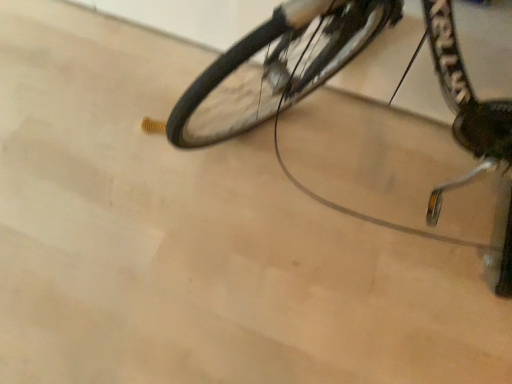
Identify the location of black rubber bicycle at center. This screenshot has height=384, width=512. (279, 65).

Describe the element at coordinates (279, 65) in the screenshot. The image size is (512, 384). I see `black rubber bicycle at center` at that location.

Describe the element at coordinates (276, 67) in the screenshot. I see `black rubber tire at center` at that location.

Find the location of a particular element. This screenshot has height=384, width=512. black rubber tire at center is located at coordinates (276, 67).

Image resolution: width=512 pixels, height=384 pixels. I want to click on black rubber bicycle at center, so click(279, 65).

Can you confirm if black rubber tire at center is positioned to the right of black rubber bicycle at center?

No.

Which object is closer to the camera taking this photo, black rubber tire at center or black rubber bicycle at center?

black rubber bicycle at center is more forward.

Which is in front, point (174, 118) or point (213, 75)?

The point (213, 75) is in front.

From the image's perspective, is black rubber tire at center below black rubber bicycle at center?

Actually, black rubber tire at center appears above black rubber bicycle at center in the image.

From a real-world perspective, which is physically above, black rubber tire at center or black rubber bicycle at center?

From a 3D spatial view, black rubber bicycle at center is above.

Which object is wider, black rubber tire at center or black rubber bicycle at center?

With larger width is black rubber bicycle at center.

Is black rubber tire at center shorter than black rubber bicycle at center?

Correct, black rubber tire at center is not as tall as black rubber bicycle at center.

Considering the relative sizes of black rubber tire at center and black rubber bicycle at center in the image provided, is black rubber tire at center smaller than black rubber bicycle at center?

Yes.

Is black rubber bicycle at center located within black rubber tire at center?

Definitely not — black rubber bicycle at center is not inside black rubber tire at center.

Is black rubber tire at center next to black rubber bicycle at center and touching it?

Yes, black rubber tire at center is touching black rubber bicycle at center.

Is black rubber tire at center aimed at black rubber bicycle at center?

Yes, black rubber tire at center is oriented towards black rubber bicycle at center.

How far apart are black rubber tire at center and black rubber bicycle at center?

A distance of 5.44 centimeters exists between black rubber tire at center and black rubber bicycle at center.

Where is `bicycle wheel lying on the left of black rubber bicycle at center`? bicycle wheel lying on the left of black rubber bicycle at center is located at coordinates (276, 67).

Looking at this image, is black rubber bicycle at center to the left of black rubber tire at center from the viewer's perspective?

No.

Relative to black rubber tire at center, is black rubber bicycle at center in front or behind?

Visually, black rubber bicycle at center is located in front of black rubber tire at center.

Which is behind, point (508, 165) or point (216, 133)?

The point (216, 133) is farther from the camera.

From the image's perspective, which is above, black rubber bicycle at center or black rubber tire at center?

From the image's view, black rubber tire at center is above.

From a real-world perspective, which is physically above, black rubber bicycle at center or black rubber tire at center?

In real-world perspective, black rubber bicycle at center is above.

Looking at this image, can you confirm if black rubber bicycle at center is wider than black rubber tire at center?

Indeed, black rubber bicycle at center has a greater width compared to black rubber tire at center.

Who is shorter, black rubber bicycle at center or black rubber tire at center?

black rubber tire at center is shorter.

Which of these two, black rubber bicycle at center or black rubber tire at center, is smaller?

black rubber tire at center is smaller.

Is black rubber bicycle at center located outside black rubber tire at center?

black rubber bicycle at center lies outside black rubber tire at center's area.

Is black rubber bicycle at center with black rubber tire at center?

Yes, black rubber bicycle at center is touching black rubber tire at center.

Is black rubber bicycle at center looking in the opposite direction of black rubber tire at center?

Absolutely, black rubber bicycle at center is directed away from black rubber tire at center.

Can you tell me how much black rubber bicycle at center and black rubber tire at center differ in facing direction?

There is a 0.326-degree angle between the facing directions of black rubber bicycle at center and black rubber tire at center.

How far apart are black rubber bicycle at center and black rubber tire at center?

A distance of 5.44 centimeters exists between black rubber bicycle at center and black rubber tire at center.

Identify the location of bicycle above the black rubber tire at center (from a real-world perspective). (279, 65).

The width and height of the screenshot is (512, 384). Identify the location of bicycle below the black rubber tire at center (from the image's perspective). (279, 65).

Where is `bicycle wheel below the black rubber bicycle at center (from a real-world perspective)`? The width and height of the screenshot is (512, 384). bicycle wheel below the black rubber bicycle at center (from a real-world perspective) is located at coordinates (276, 67).